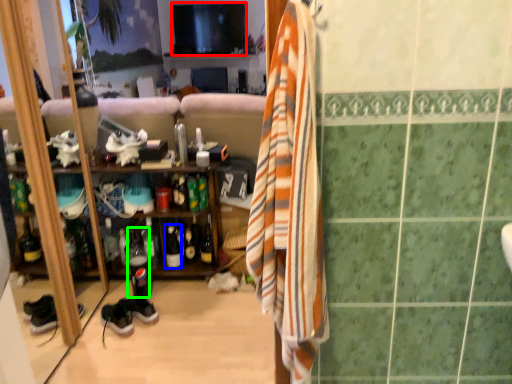
Question: Estimate the real-world distances between objects in this image. Which object is closer to television (highlighted by a red box), bottle (highlighted by a blue box) or bottle (highlighted by a green box)?

Choices:
 (A) bottle
 (B) bottle

Answer: (B)